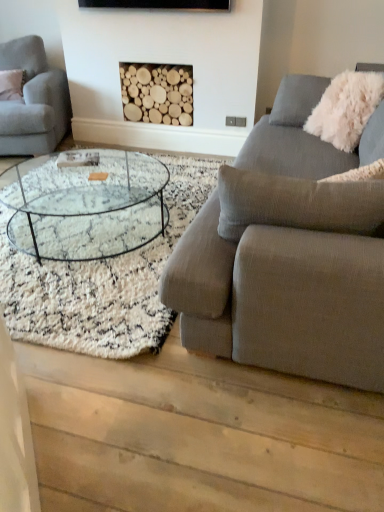
Question: Considering the relative sizes of natural wood logs at center and textured gray couch at right, the first studio couch when ordered from front to back, in the image provided, is natural wood logs at center shorter than textured gray couch at right, the first studio couch when ordered from front to back,?

Choices:
 (A) yes
 (B) no

Answer: (A)

Question: From the image's perspective, is natural wood logs at center on top of textured gray couch at right, marked as the second studio couch in a left-to-right arrangement?

Choices:
 (A) no
 (B) yes

Answer: (B)

Question: Considering the relative positions of natural wood logs at center and textured gray couch at right, the 1th studio couch from the right, in the image provided, is natural wood logs at center to the right of textured gray couch at right, the 1th studio couch from the right, from the viewer's perspective?

Choices:
 (A) yes
 (B) no

Answer: (B)

Question: Are natural wood logs at center and textured gray couch at right, the 1th studio couch from the right, beside each other?

Choices:
 (A) no
 (B) yes

Answer: (A)

Question: Could textured gray couch at right, the first studio couch when ordered from front to back, be considered to be inside natural wood logs at center?

Choices:
 (A) yes
 (B) no

Answer: (B)

Question: Looking at their shapes, would you say natural wood logs at center is wider or thinner than white fluffy pillow at upper right?

Choices:
 (A) thin
 (B) wide

Answer: (A)

Question: Is natural wood logs at center inside the boundaries of white fluffy pillow at upper right, or outside?

Choices:
 (A) inside
 (B) outside

Answer: (B)

Question: In terms of size, does natural wood logs at center appear bigger or smaller than white fluffy pillow at upper right?

Choices:
 (A) small
 (B) big

Answer: (A)

Question: From a real-world perspective, is natural wood logs at center positioned above or below white fluffy pillow at upper right?

Choices:
 (A) below
 (B) above

Answer: (A)

Question: Is light gray fabric couch at left, positioned as the 2th studio couch in right-to-left order, situated inside textured gray couch at right, the first studio couch when ordered from front to back, or outside?

Choices:
 (A) outside
 (B) inside

Answer: (A)

Question: Relative to textured gray couch at right, marked as the second studio couch in a left-to-right arrangement, is light gray fabric couch at left, positioned as the 2th studio couch in right-to-left order, in front or behind?

Choices:
 (A) behind
 (B) front

Answer: (A)

Question: Does point [36, 99] appear closer or farther from the camera than point [266, 223]?

Choices:
 (A) closer
 (B) farther

Answer: (B)

Question: From the image's perspective, is light gray fabric couch at left, positioned as the 2th studio couch in right-to-left order, positioned above or below textured gray couch at right, marked as the second studio couch in a left-to-right arrangement?

Choices:
 (A) below
 (B) above

Answer: (B)

Question: Considering the positions of point (120, 168) and point (370, 364), is point (120, 168) closer or farther from the camera than point (370, 364)?

Choices:
 (A) farther
 (B) closer

Answer: (A)

Question: Is clear glass coffee table at center wider or thinner than textured gray couch at right, marked as the second studio couch in a left-to-right arrangement?

Choices:
 (A) thin
 (B) wide

Answer: (B)